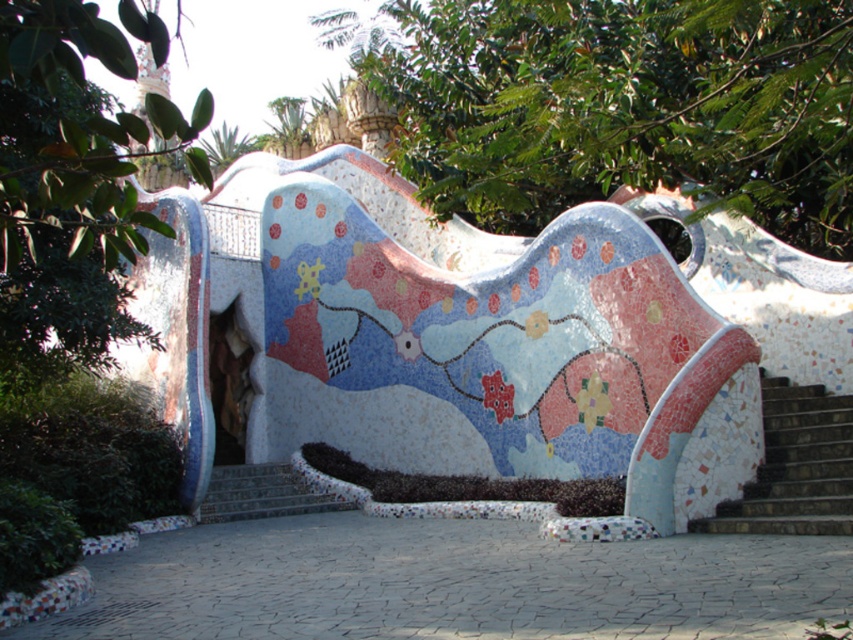
Question: Which point is closer to the camera taking this photo?

Choices:
 (A) (775, 474)
 (B) (329, 508)
 (C) (222, 282)

Answer: (A)

Question: Which object is closer to the camera taking this photo?

Choices:
 (A) mosaic bench at center
 (B) dark brown stone stairs at right
 (C) multicolored mosaic stairs at center

Answer: (B)

Question: Observing the image, what is the correct spatial positioning of mosaic bench at center in reference to multicolored mosaic stairs at center?

Choices:
 (A) below
 (B) above

Answer: (B)

Question: Which object is closer to the camera taking this photo?

Choices:
 (A) dark brown stone stairs at right
 (B) multicolored mosaic stairs at center
 (C) mosaic bench at center

Answer: (A)

Question: Does mosaic bench at center appear on the left side of dark brown stone stairs at right?

Choices:
 (A) yes
 (B) no

Answer: (A)

Question: Can you confirm if dark brown stone stairs at right is bigger than multicolored mosaic stairs at center?

Choices:
 (A) no
 (B) yes

Answer: (B)